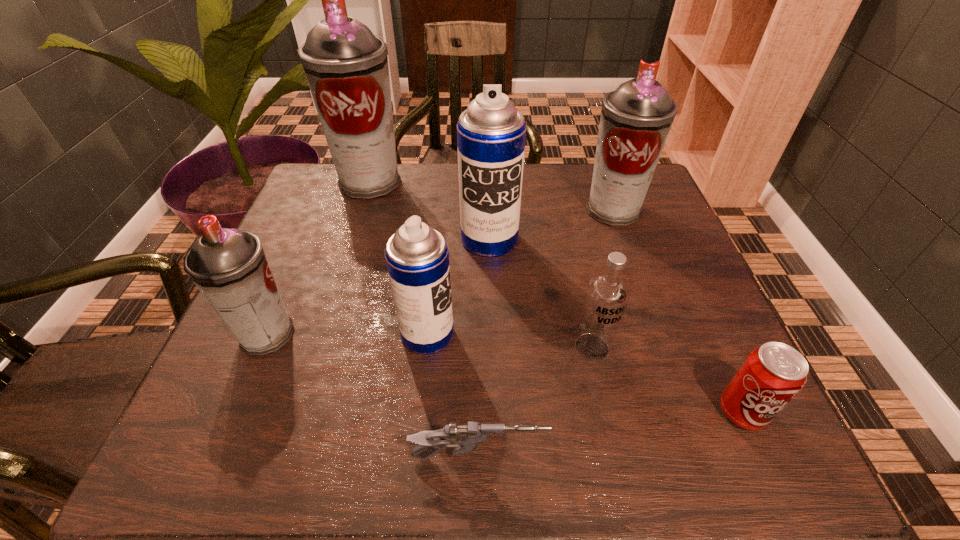
Locate an element on the screen. free space located on the front label of the vodka is located at coordinates (606, 411).

This screenshot has width=960, height=540. What are the coordinates of `blank area located 0.300m on the back of the seventh tallest object` in the screenshot? It's located at (677, 268).

The height and width of the screenshot is (540, 960). I want to click on vacant space located 0.350m at the barrel of the gun, so click(777, 458).

The width and height of the screenshot is (960, 540). What are the coordinates of `soda present at the near edge` in the screenshot? It's located at (771, 376).

This screenshot has width=960, height=540. Find the location of `gun that is at the near edge`. gun that is at the near edge is located at coordinates (466, 438).

This screenshot has width=960, height=540. Identify the location of aerosol can situated at the right edge. (636, 118).

The image size is (960, 540). In order to click on soda present at the right edge in this screenshot , I will do `click(771, 376)`.

Image resolution: width=960 pixels, height=540 pixels. Identify the location of object positioned at the far left corner. (346, 66).

I want to click on object situated at the far right corner, so click(636, 118).

Locate an element on the screen. This screenshot has height=540, width=960. object located at the near right corner is located at coordinates (771, 376).